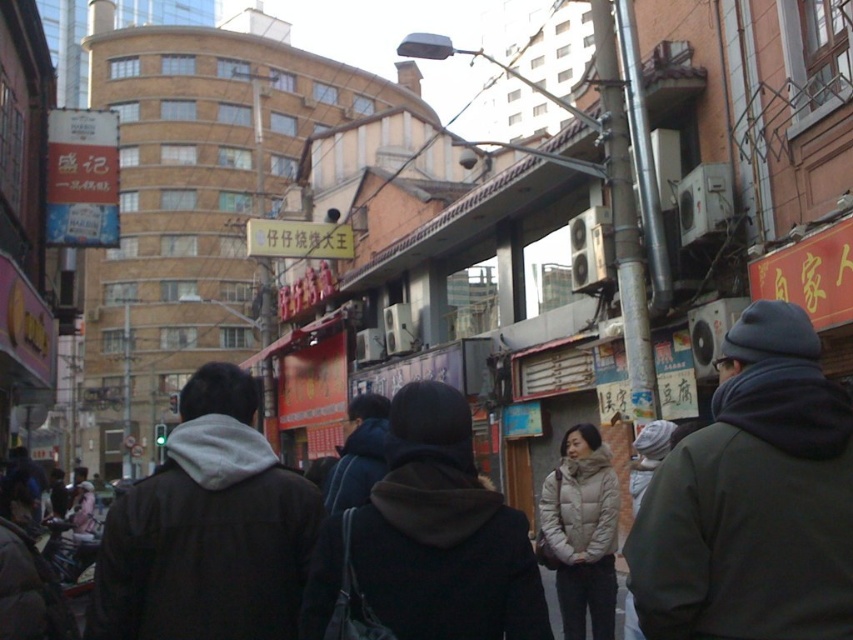
Which is more to the right, dark gray knit hat at upper right or dark gray hoodie at center?

dark gray knit hat at upper right is more to the right.

Between point (712, 538) and point (215, 540), which one is positioned behind?

The point (215, 540) is behind.

This screenshot has width=853, height=640. Find the location of `dark gray knit hat at upper right`. dark gray knit hat at upper right is located at coordinates (753, 500).

You are a GUI agent. You are given a task and a screenshot of the screen. Output one action in this format:
    pyautogui.click(x=<x>, y=<y>)
    Task: Click on the dark gray knit hat at upper right
    
    Given the screenshot: What is the action you would take?
    (753, 500)

Who is shorter, dark gray knit hat at upper right or white down jacket at center?

With less height is dark gray knit hat at upper right.

Who is positioned more to the left, dark gray knit hat at upper right or white down jacket at center?

From the viewer's perspective, white down jacket at center appears more on the left side.

What do you see at coordinates (753, 500) in the screenshot? The height and width of the screenshot is (640, 853). I see `dark gray knit hat at upper right` at bounding box center [753, 500].

Locate an element on the screen. dark gray knit hat at upper right is located at coordinates (753, 500).

Who is shorter, dark gray hoodie at center or black fuzzy jacket at center?

black fuzzy jacket at center

At what (x,y) coordinates should I click in order to perform the action: click on dark gray hoodie at center. Please return your answer as a coordinate pair (x, y). This screenshot has height=640, width=853. Looking at the image, I should click on (207, 529).

Identify the location of dark gray hoodie at center. (207, 529).

Find the location of a particular element. dark gray hoodie at center is located at coordinates (207, 529).